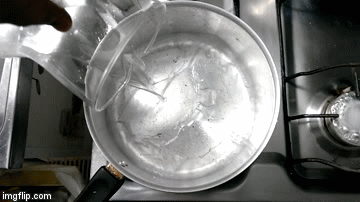
You are a GUI agent. You are given a task and a screenshot of the screen. Output one action in this format:
    pyautogui.click(x=<x>, y=<y>)
    Task: Click on the wall
    This screenshot has width=360, height=202.
    Given the screenshot: What is the action you would take?
    pyautogui.click(x=41, y=134)